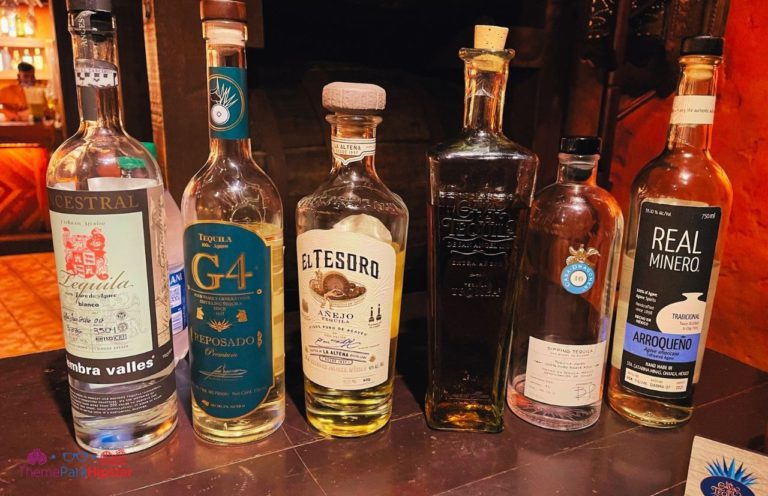
The width and height of the screenshot is (768, 496). What are the coordinates of `cork` in the screenshot? It's located at (492, 31).